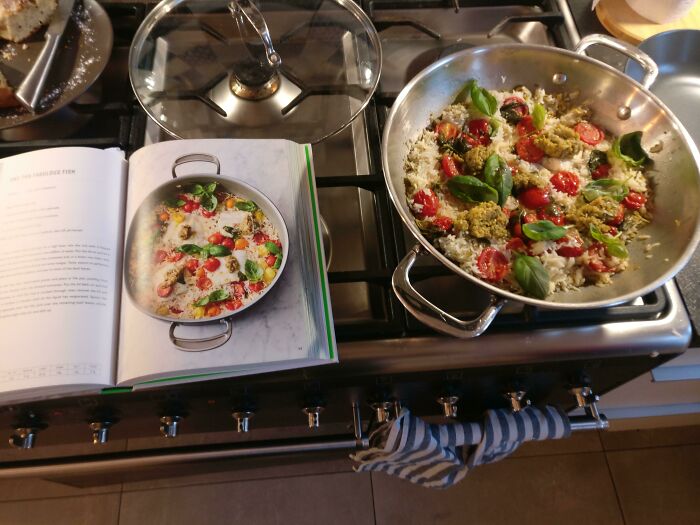
Identify the location of photo of pan. (269, 210).